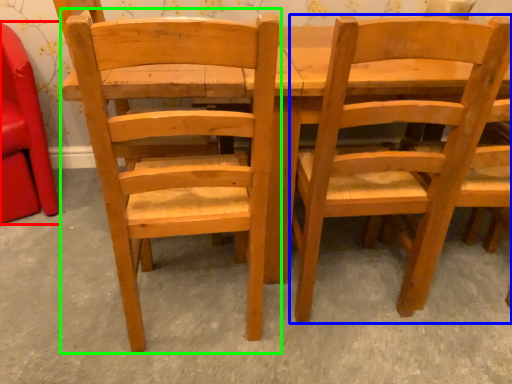
Question: Estimate the real-world distances between objects in this image. Which object is farther from chair (highlighted by a red box), chair (highlighted by a blue box) or chair (highlighted by a green box)?

Choices:
 (A) chair
 (B) chair

Answer: (A)